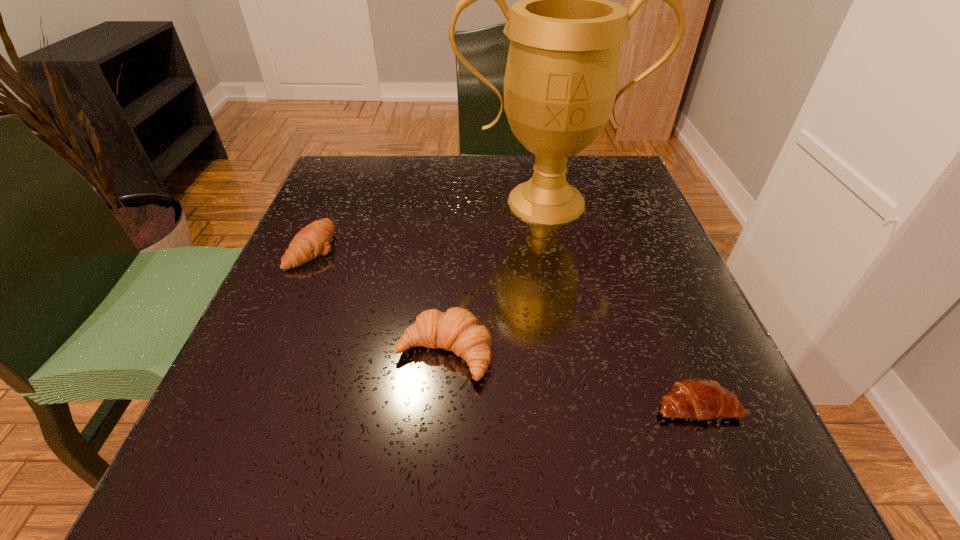
Locate an element on the screen. This screenshot has height=540, width=960. vacant region between the tallest crescent roll and the tallest object is located at coordinates (495, 278).

Find the location of a particular element. The width and height of the screenshot is (960, 540). empty location between the shortest object and the second crescent roll from left to right is located at coordinates (570, 379).

Locate an element on the screen. vacant area that lies between the farthest crescent roll and the tallest crescent roll is located at coordinates (379, 300).

Locate which object ranks second in proximity to the second tallest object. Please provide its 2D coordinates. Your answer should be formatted as a tuple, i.e. [(x, y)], where the tuple contains the x and y coordinates of a point satisfying the conditions above.

[(698, 398)]

Locate which object is the third closest to the shortest object. Please provide its 2D coordinates. Your answer should be formatted as a tuple, i.e. [(x, y)], where the tuple contains the x and y coordinates of a point satisfying the conditions above.

[(314, 239)]

Locate which crescent roll ranks second in proximity to the farthest crescent roll. Please provide its 2D coordinates. Your answer should be formatted as a tuple, i.e. [(x, y)], where the tuple contains the x and y coordinates of a point satisfying the conditions above.

[(698, 398)]

Identify which crescent roll is the nearest to the leftmost object. Please provide its 2D coordinates. Your answer should be formatted as a tuple, i.e. [(x, y)], where the tuple contains the x and y coordinates of a point satisfying the conditions above.

[(457, 330)]

The width and height of the screenshot is (960, 540). I want to click on vacant space that satisfies the following two spatial constraints: 1. on the engravings side of the rightmost crescent roll; 2. on the left side of the tallest object, so click(x=587, y=405).

Locate an element on the screen. Image resolution: width=960 pixels, height=540 pixels. vacant region that satisfies the following two spatial constraints: 1. on the engravings side of the rightmost crescent roll; 2. on the right side of the trophy is located at coordinates (587, 405).

Find the location of a particular element. This screenshot has height=540, width=960. vacant space that satisfies the following two spatial constraints: 1. on the engravings side of the rightmost crescent roll; 2. on the left side of the trophy is located at coordinates (587, 405).